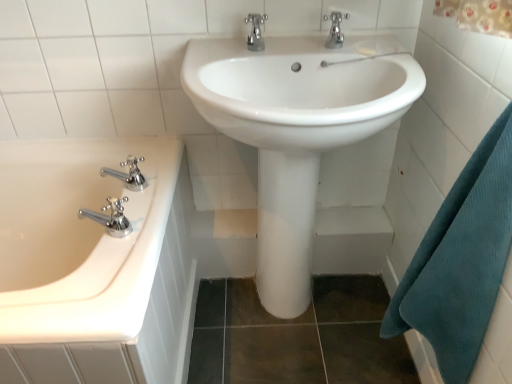
Find the location of a particular element. The image size is (512, 384). free space to the left of chrome metallic faucet at upper center, the first tap in the top-to-bottom sequence is located at coordinates (264, 43).